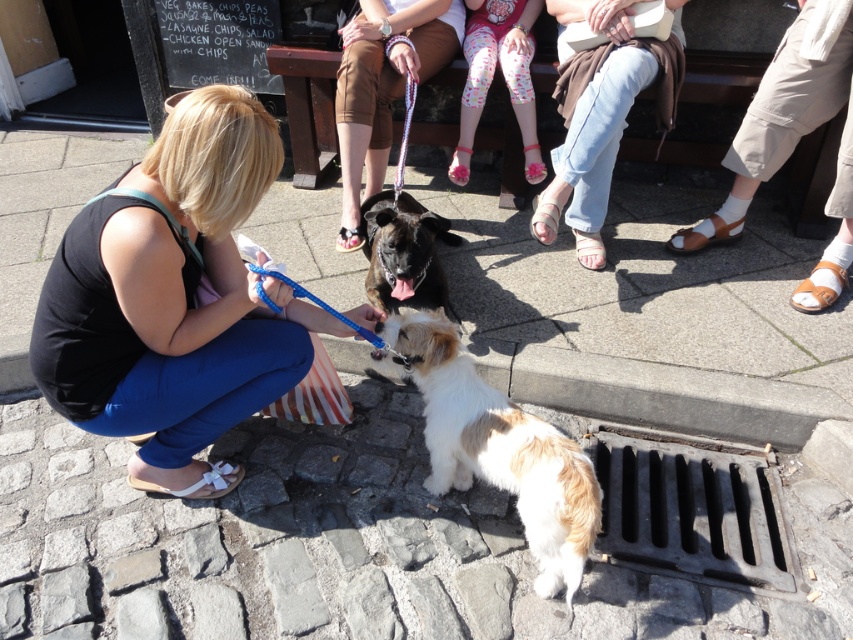
You are standing at the point with coordinates point [445,230] and want to walk towards the point with coordinates point [576,474]. Which direction should you move?

You should move towards the point [576,474] because it is closer to you than point [445,230].